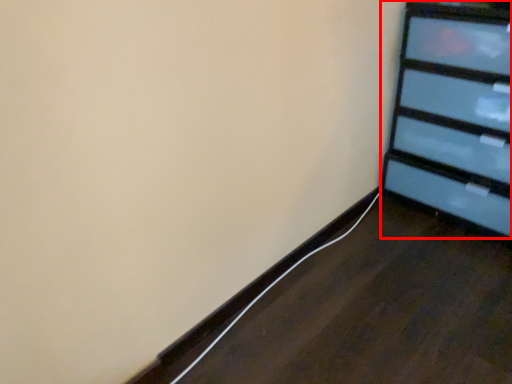
Question: From the image, what is the correct spatial relationship of furniture (annotated by the red box) in relation to cable?

Choices:
 (A) left
 (B) right

Answer: (B)